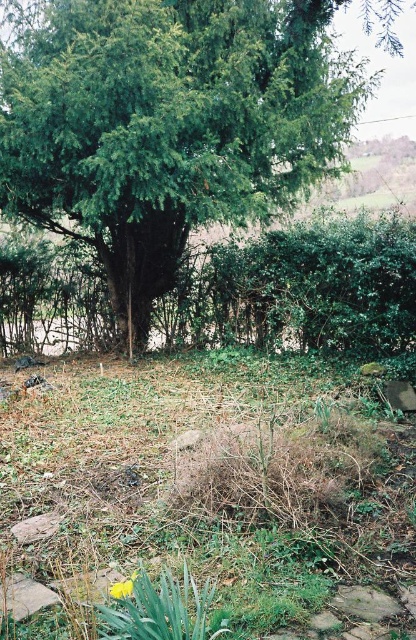
You are a gardener who wants to plant a new flower that needs sunlight. You see the green leafy hedge at center and the yellow matte flower at lower center. Which object is taller and might block the sunlight for the new flower?

The green leafy hedge at center is much taller than the yellow matte flower at lower center, so it might block the sunlight for the new flower.

From the picture: You are standing at the point marked by coordinates point (210, 493). Looking around, you see the large coniferous tree with thick trunk and dense foliage. What is directly under your feet?

The point (210, 493) is labeled as green grass at center, so the area directly under your feet is green grass at center.

You are a gardener who needs to water both the green leafy tree at center and the yellow matte flower at lower center. You have a watering can that can hold enough water for 5 meters of distance. Can you water both without needing to refill your watering can?

The green leafy tree at center and yellow matte flower at lower center are 5.59 meters apart. Since the watering can can only cover 5 meters, you would need to refill it after watering one of them because the distance between them exceeds the can capacity.